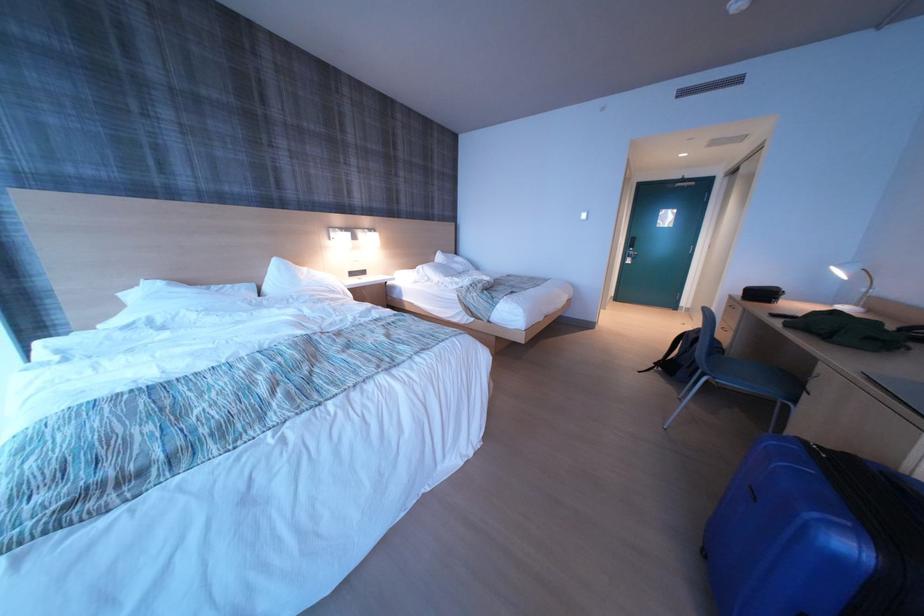
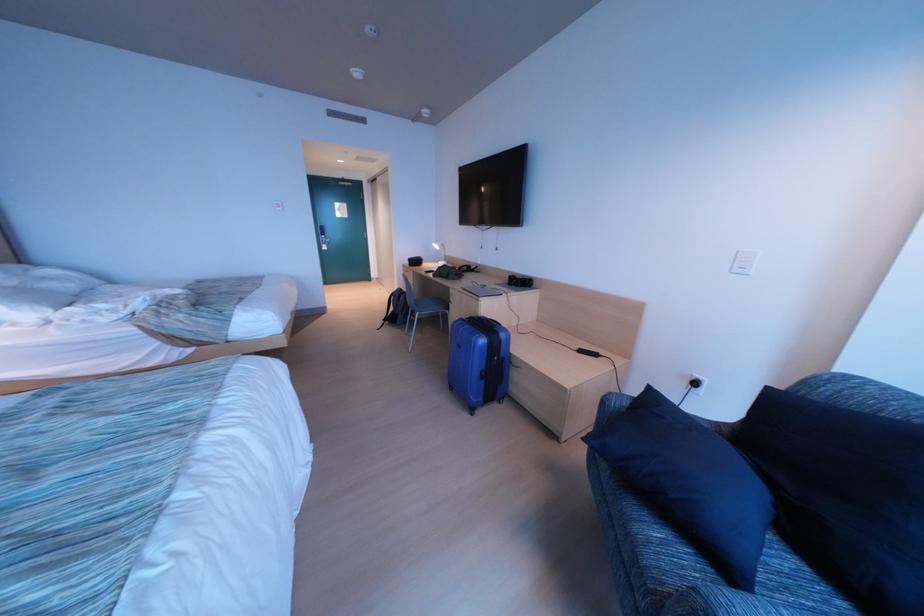
Question: The camera is either moving clockwise (left) or counter-clockwise (right) around the object. The first image is from the beginning of the video and the second image is from the end. Is the camera moving left or right when shooting the video?

Choices:
 (A) Left
 (B) Right

Answer: (A)